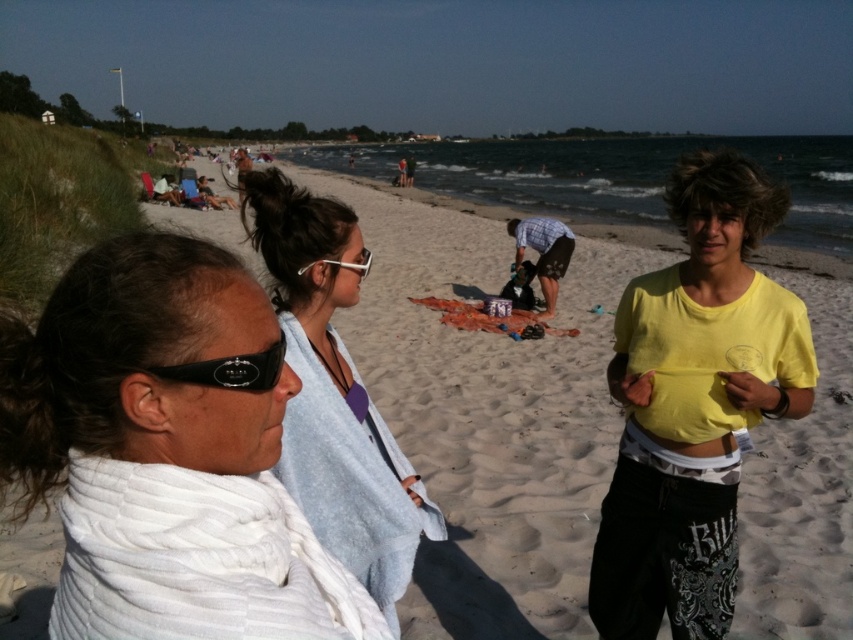
You are a photographer trying to capture the white towel at center and the black rubber goggles at left in the same frame. Based on their sizes in the image, which object will appear larger in the photo?

The white towel at center will appear larger in the photo because it has a greater height compared to the black rubber goggles at left.

You are a photographer trying to capture a closeup of the black rubber goggles at left without the white towel at left blocking the view. Is this possible from your current position?

The white towel at left is in front of the black rubber goggles at left, so you cannot capture a clear closeup of the black rubber goggles at left without moving the white towel at left or changing your position to see around it.